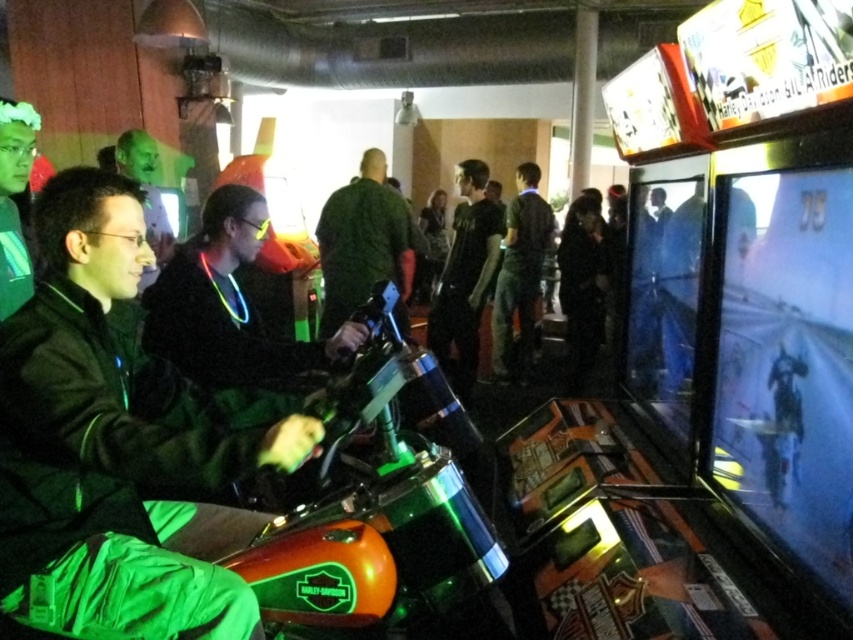
Is point (62, 186) positioned in front of point (194, 282)?

Yes.

How far apart are green matte jacket at center and black matte jacket at center?

The distance of green matte jacket at center from black matte jacket at center is 25.75 inches.

Is point (24, 356) closer to camera compared to point (236, 230)?

Yes, it is in front of point (236, 230).

I want to click on green matte jacket at center, so click(x=112, y=440).

Does black cotton shirt at center have a smaller size compared to dark green shirt at center?

No, black cotton shirt at center is not smaller than dark green shirt at center.

Between point (457, 227) and point (503, 358), which one is positioned in front?

Point (457, 227)

This screenshot has height=640, width=853. Find the location of `black cotton shirt at center`. black cotton shirt at center is located at coordinates (465, 276).

In order to click on green matte shirt at center in this screenshot , I will do `click(364, 243)`.

Can you confirm if green matte shirt at center is taller than dark green shirt at center?

Incorrect, green matte shirt at center's height is not larger of dark green shirt at center's.

Between point (357, 275) and point (497, 362), which one is positioned in front?

Point (357, 275) is in front.

The width and height of the screenshot is (853, 640). What are the coordinates of `green matte shirt at center` in the screenshot? It's located at (364, 243).